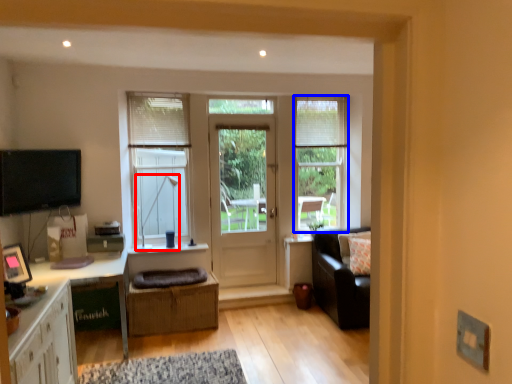
Question: Which of the following is the closest to the observer, lamp (highlighted by a red box) or window (highlighted by a blue box)?

Choices:
 (A) lamp
 (B) window

Answer: (A)